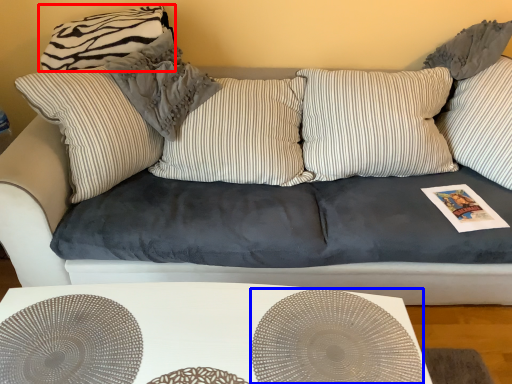
Question: Which point is further to the camera, pillow (highlighted by a red box) or circle (highlighted by a blue box)?

Choices:
 (A) pillow
 (B) circle

Answer: (A)